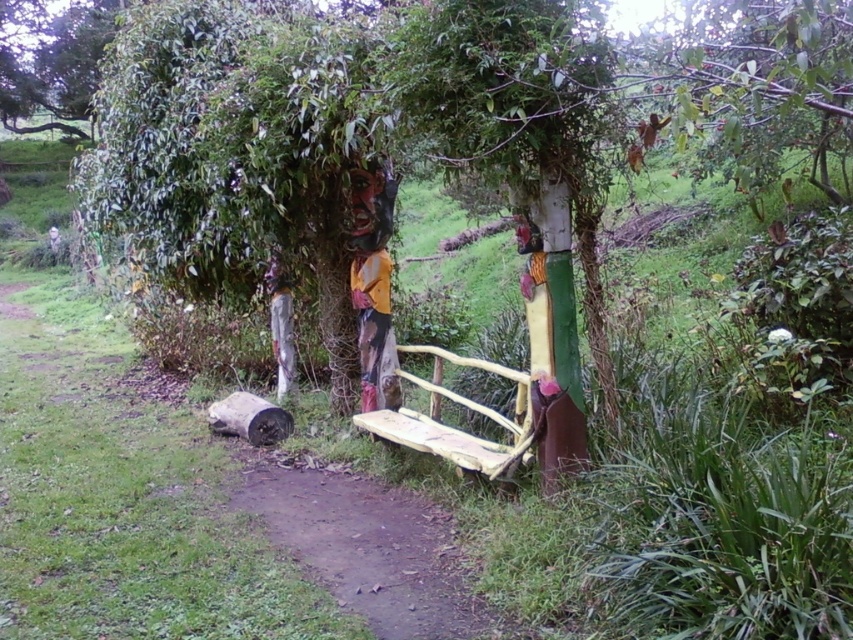
Does dirt path at center appear under yellow painted wood bench at center?

Indeed, dirt path at center is positioned under yellow painted wood bench at center.

Does dirt path at center have a smaller size compared to yellow painted wood bench at center?

Yes.

The width and height of the screenshot is (853, 640). What do you see at coordinates (364, 547) in the screenshot?
I see `dirt path at center` at bounding box center [364, 547].

Identify the location of dirt path at center. The width and height of the screenshot is (853, 640). pos(364,547).